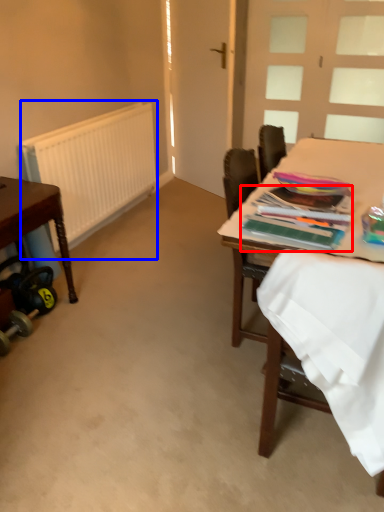
Question: Which object is further to the camera taking this photo, magazine (highlighted by a red box) or radiator (highlighted by a blue box)?

Choices:
 (A) magazine
 (B) radiator

Answer: (B)